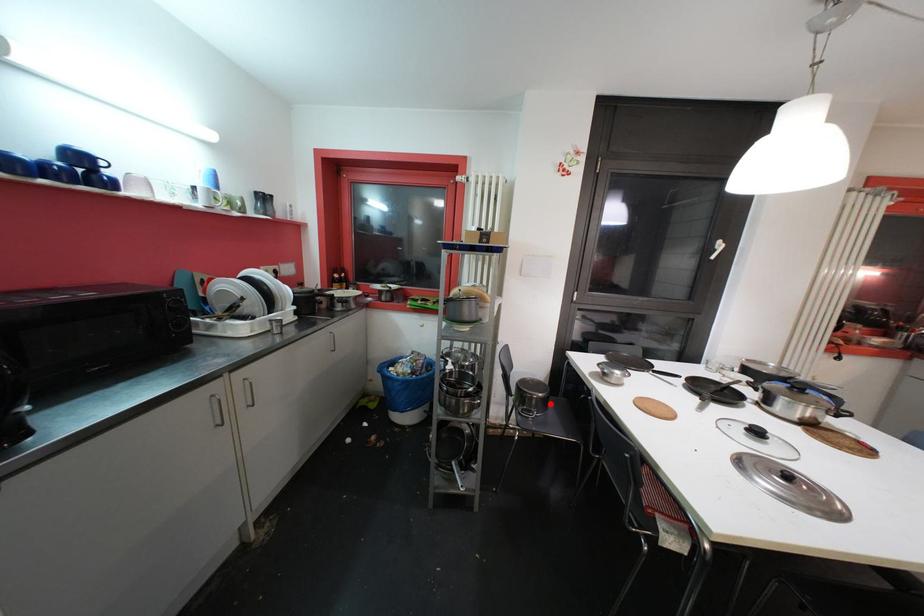
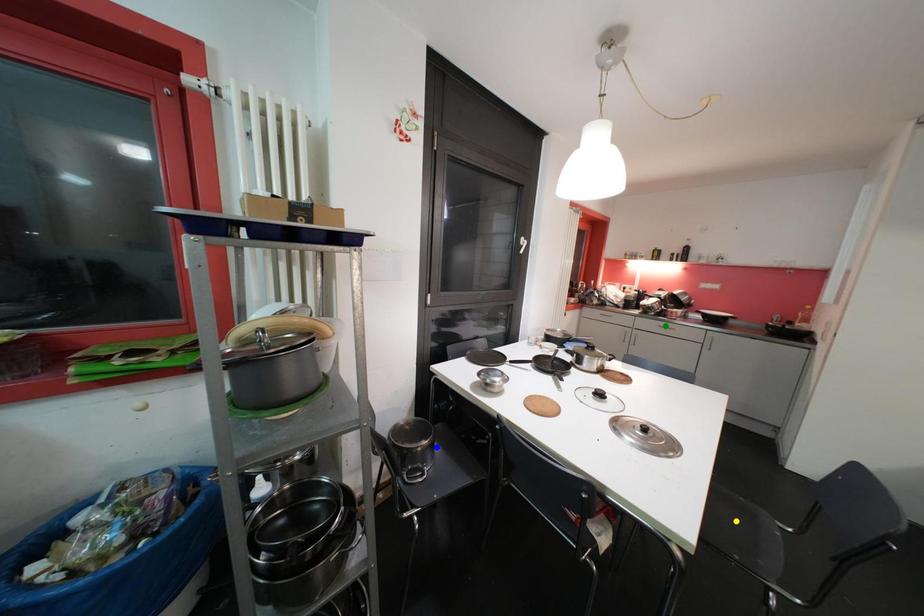
Question: I am providing you with two images of the same scene from different viewpoints. A red point is marked on the first image. You are given multiple points on the second image. Which spot in image 2 lines up with the point in image 1?

Choices:
 (A) green point
 (B) blue point
 (C) yellow point

Answer: (B)